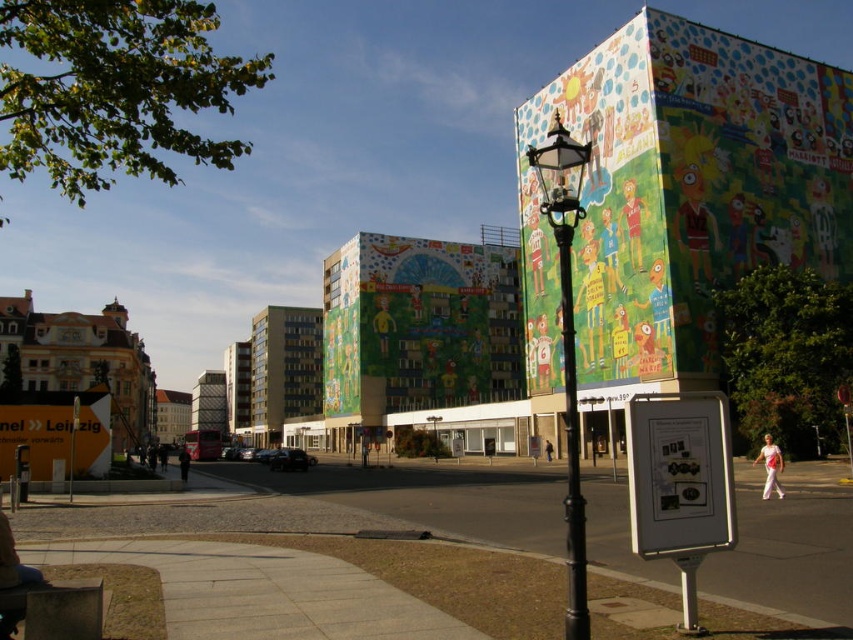
From the picture: You are standing on the street in front of the building with murals. You see two points marked on the ground at coordinates point [840,541] and point [579,182]. If you want to walk towards the building, which point should you step on first?

You should step on point [840,541] first because it is in front of point 0.288, 0.681, meaning it is closer to your current position when facing the building.